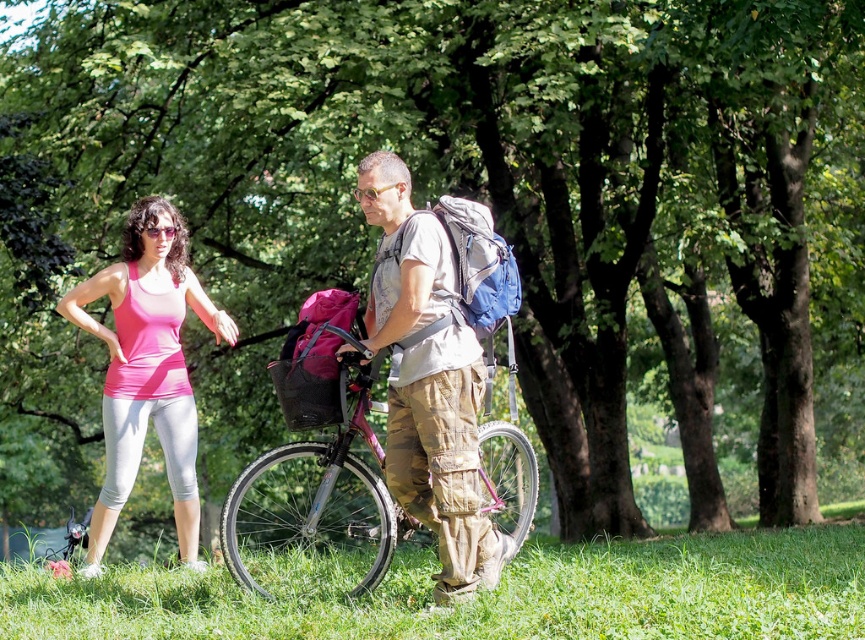
Question: Which object appears farthest from the camera in this image?

Choices:
 (A) pink matte bicycle at center
 (B) green grass at lower center
 (C) pink fabric tank top at left

Answer: (C)

Question: From the image, what is the correct spatial relationship of green grass at lower center in relation to camouflage pants at center?

Choices:
 (A) below
 (B) above

Answer: (A)

Question: Which object is positioned farthest from the green grass at lower center?

Choices:
 (A) camouflage pants at center
 (B) pink matte bicycle at center

Answer: (B)

Question: Considering the relative positions of green grass at lower center and pink fabric tank top at left in the image provided, where is green grass at lower center located with respect to pink fabric tank top at left?

Choices:
 (A) below
 (B) above

Answer: (A)

Question: Can you confirm if green grass at lower center is positioned to the left of pink matte bicycle at center?

Choices:
 (A) yes
 (B) no

Answer: (B)

Question: Among these points, which one is nearest to the camera?

Choices:
 (A) (498, 525)
 (B) (452, 288)
 (C) (183, 400)

Answer: (B)